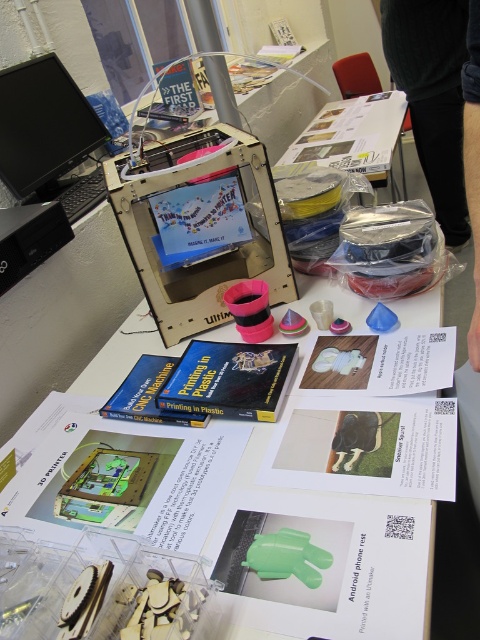
Does metallic/transparent 3d printer at center appear under translucent plastic table at upper center?

Yes, metallic/transparent 3d printer at center is below translucent plastic table at upper center.

Can you confirm if metallic/transparent 3d printer at center is bigger than translucent plastic table at upper center?

Incorrect, metallic/transparent 3d printer at center is not larger than translucent plastic table at upper center.

Is point (237, 214) less distant than point (330, 152)?

Yes, it is.

This screenshot has height=640, width=480. Find the location of `metallic/transparent 3d printer at center`. metallic/transparent 3d printer at center is located at coordinates (200, 227).

Can you confirm if black glossy monitor at upper left is positioned to the left of black fabric pants at lower right?

Correct, you'll find black glossy monitor at upper left to the left of black fabric pants at lower right.

Between black glossy monitor at upper left and black fabric pants at lower right, which one has more height?

black fabric pants at lower right

The image size is (480, 640). I want to click on black glossy monitor at upper left, so click(43, 125).

Where is `black glossy monitor at upper left`? This screenshot has height=640, width=480. black glossy monitor at upper left is located at coordinates (43, 125).

Between point (476, 74) and point (87, 176), which one is positioned behind?

Positioned behind is point (87, 176).

Can you confirm if black fabric pants at lower right is bigger than black plastic keyboard at left?

Indeed, black fabric pants at lower right has a larger size compared to black plastic keyboard at left.

Does point (479, 292) lie in front of point (74, 202)?

Yes, point (479, 292) is closer to viewer.

What are the coordinates of `black fabric pants at lower right` in the screenshot? It's located at (472, 163).